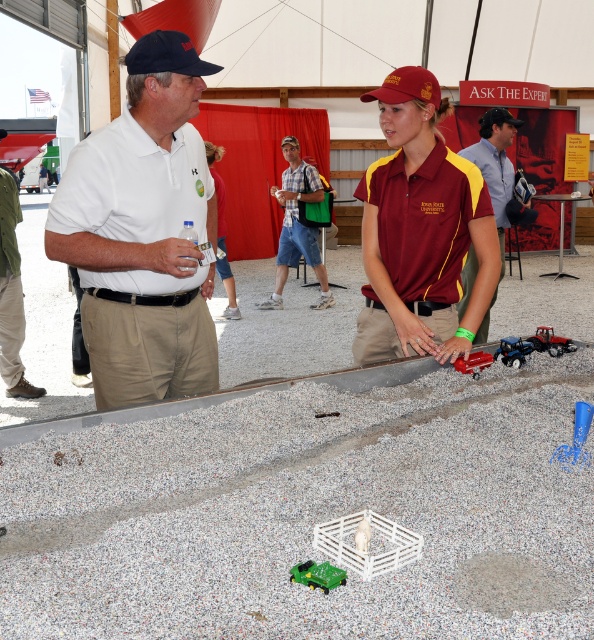
Which is below, maroon fabric shirt at center or blue plastic toy at center?

blue plastic toy at center is lower down.

Looking at this image, who is more distant from viewer, (230, 284) or (587, 426)?

Positioned behind is point (230, 284).

In order to click on maroon fabric shirt at center in this screenshot , I will do `click(222, 232)`.

Is plaid shirt at center bigger than green plastic tractor at center?

Indeed, plaid shirt at center has a larger size compared to green plastic tractor at center.

Between point (298, 227) and point (342, 570), which one is positioned in front?

Positioned in front is point (342, 570).

Who is more forward, (282,256) or (342,577)?

Positioned in front is point (342,577).

At what (x,y) coordinates should I click in order to perform the action: click on plaid shirt at center. Please return your answer as a coordinate pair (x, y). This screenshot has height=640, width=594. Looking at the image, I should click on (298, 225).

Is white matte shirt at center bigger than blue plastic toy at center?

Indeed, white matte shirt at center has a larger size compared to blue plastic toy at center.

Is white matte shirt at center smaller than blue plastic toy at center?

Incorrect, white matte shirt at center is not smaller in size than blue plastic toy at center.

The image size is (594, 640). In order to click on white matte shirt at center in this screenshot , I will do `click(143, 232)`.